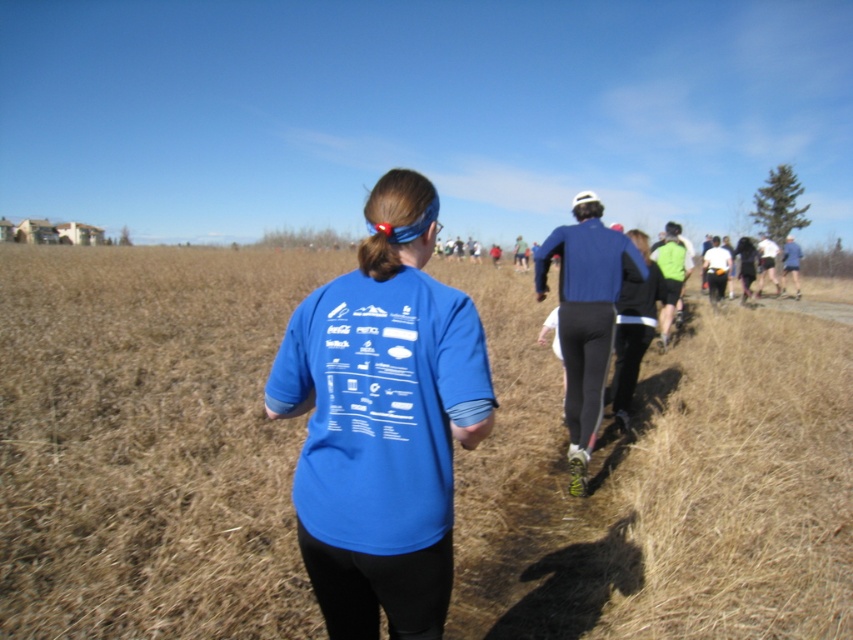
Question: Based on their relative distances, which object is nearer to the matte blue t-shirt at center?

Choices:
 (A) brown dry grass at center
 (B) blue fabric jacket at center

Answer: (B)

Question: Which of the following is the farthest from the observer?

Choices:
 (A) blue fabric jacket at center
 (B) brown dry grass at center

Answer: (A)

Question: Is brown dry grass at center wider than matte blue t-shirt at center?

Choices:
 (A) yes
 (B) no

Answer: (A)

Question: Which of these objects is positioned closest to the blue fabric jacket at center?

Choices:
 (A) matte blue t-shirt at center
 (B) brown dry grass at center

Answer: (A)

Question: Can you confirm if brown dry grass at center is positioned to the right of matte blue t-shirt at center?

Choices:
 (A) no
 (B) yes

Answer: (A)

Question: Can you confirm if brown dry grass at center is wider than matte blue t-shirt at center?

Choices:
 (A) no
 (B) yes

Answer: (B)